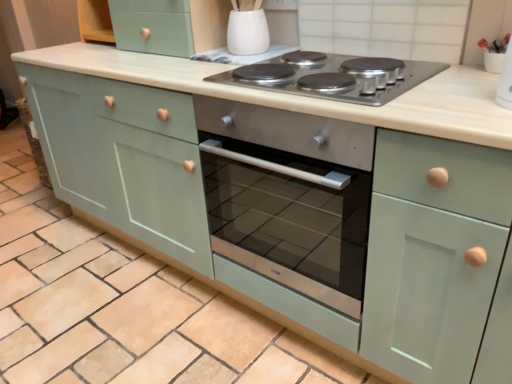
What do you see at coordinates (348, 91) in the screenshot? The height and width of the screenshot is (384, 512). I see `stainless steel cooktop at center` at bounding box center [348, 91].

Locate an element on the screen. The image size is (512, 384). stainless steel cooktop at center is located at coordinates (348, 91).

Locate an element on the screen. The height and width of the screenshot is (384, 512). white glossy vase at upper center is located at coordinates (248, 33).

What do you see at coordinates (248, 33) in the screenshot?
I see `white glossy vase at upper center` at bounding box center [248, 33].

Where is `stainless steel cooktop at center`? Image resolution: width=512 pixels, height=384 pixels. stainless steel cooktop at center is located at coordinates (348, 91).

Between stainless steel cooktop at center and white glossy vase at upper center, which one appears on the right side from the viewer's perspective?

stainless steel cooktop at center.

Looking at this image, is stainless steel cooktop at center in front of white glossy vase at upper center?

That is True.

Is point (284, 83) closer to camera compared to point (264, 48)?

Yes, it is in front of point (264, 48).

From the image's perspective, is stainless steel cooktop at center over white glossy vase at upper center?

No, from the image's perspective, stainless steel cooktop at center is not over white glossy vase at upper center.

From a real-world perspective, who is located lower, stainless steel cooktop at center or white glossy vase at upper center?

In real-world perspective, stainless steel cooktop at center is lower.

Which of these two, stainless steel cooktop at center or white glossy vase at upper center, is thinner?

With smaller width is white glossy vase at upper center.

Can you confirm if stainless steel cooktop at center is taller than white glossy vase at upper center?

In fact, stainless steel cooktop at center may be shorter than white glossy vase at upper center.

Considering the sizes of objects stainless steel cooktop at center and white glossy vase at upper center in the image provided, who is bigger, stainless steel cooktop at center or white glossy vase at upper center?

Bigger between the two is stainless steel cooktop at center.

Choose the correct answer: Is stainless steel cooktop at center inside white glossy vase at upper center or outside it?

The correct answer is: outside.

Is stainless steel cooktop at center not close to white glossy vase at upper center?

No.

Is stainless steel cooktop at center oriented away from white glossy vase at upper center?

No, stainless steel cooktop at center is not facing away from white glossy vase at upper center.

How far apart are stainless steel cooktop at center and white glossy vase at upper center?

13.34 inches.

Find the location of `appliance above the stainless steel cooktop at center (from a real-world perspective)`. appliance above the stainless steel cooktop at center (from a real-world perspective) is located at coordinates (248, 33).

Would you say white glossy vase at upper center is to the left or to the right of stainless steel cooktop at center in the picture?

Based on their positions, white glossy vase at upper center is located to the left of stainless steel cooktop at center.

Which object is closer to the camera taking this photo, white glossy vase at upper center or stainless steel cooktop at center?

stainless steel cooktop at center is more forward.

Does point (249, 21) come in front of point (409, 88)?

No, (249, 21) is behind (409, 88).

From the picture: From the image's perspective, is white glossy vase at upper center located beneath stainless steel cooktop at center?

No.

From a real-world perspective, which is physically below, white glossy vase at upper center or stainless steel cooktop at center?

In real-world perspective, stainless steel cooktop at center is lower.

Which object is wider, white glossy vase at upper center or stainless steel cooktop at center?

stainless steel cooktop at center.

Can you confirm if white glossy vase at upper center is taller than stainless steel cooktop at center?

Indeed, white glossy vase at upper center has a greater height compared to stainless steel cooktop at center.

Based on their sizes in the image, would you say white glossy vase at upper center is bigger or smaller than stainless steel cooktop at center?

Considering their sizes, white glossy vase at upper center takes up less space than stainless steel cooktop at center.

Is white glossy vase at upper center located outside stainless steel cooktop at center?

That's correct, white glossy vase at upper center is outside of stainless steel cooktop at center.

Is white glossy vase at upper center beside stainless steel cooktop at center?

white glossy vase at upper center is not next to stainless steel cooktop at center, and they're not touching.

Is white glossy vase at upper center looking in the opposite direction of stainless steel cooktop at center?

white glossy vase at upper center is not turned away from stainless steel cooktop at center.

How many degrees apart are the facing directions of white glossy vase at upper center and stainless steel cooktop at center?

The facing directions of white glossy vase at upper center and stainless steel cooktop at center are 4.02 degrees apart.

Measure the distance from white glossy vase at upper center to stainless steel cooktop at center.

white glossy vase at upper center is 13.34 inches from stainless steel cooktop at center.

I want to click on appliance above the stainless steel cooktop at center (from a real-world perspective), so click(248, 33).

In the image, there is a white glossy vase at upper center. At what (x,y) coordinates should I click in order to perform the action: click on gas stove below it (from the image's perspective). Please return your answer as a coordinate pair (x, y). The height and width of the screenshot is (384, 512). Looking at the image, I should click on [x=348, y=91].

At what (x,y) coordinates should I click in order to perform the action: click on appliance above the stainless steel cooktop at center (from the image's perspective). Please return your answer as a coordinate pair (x, y). This screenshot has height=384, width=512. Looking at the image, I should click on (248, 33).